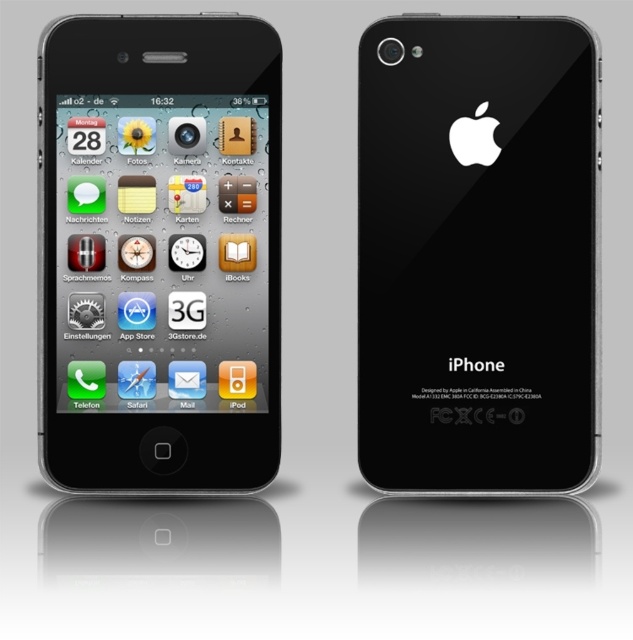
Who is more distant from viewer, (144,468) or (410,188)?

The point (410,188) is more distant.

Can you confirm if black glossy iphone at left is wider than black glossy iphone at center?

Yes, black glossy iphone at left is wider than black glossy iphone at center.

Identify the location of black glossy iphone at left. The height and width of the screenshot is (640, 633). (158, 253).

Locate an element on the screen. Image resolution: width=633 pixels, height=640 pixels. black glossy iphone at left is located at coordinates (158, 253).